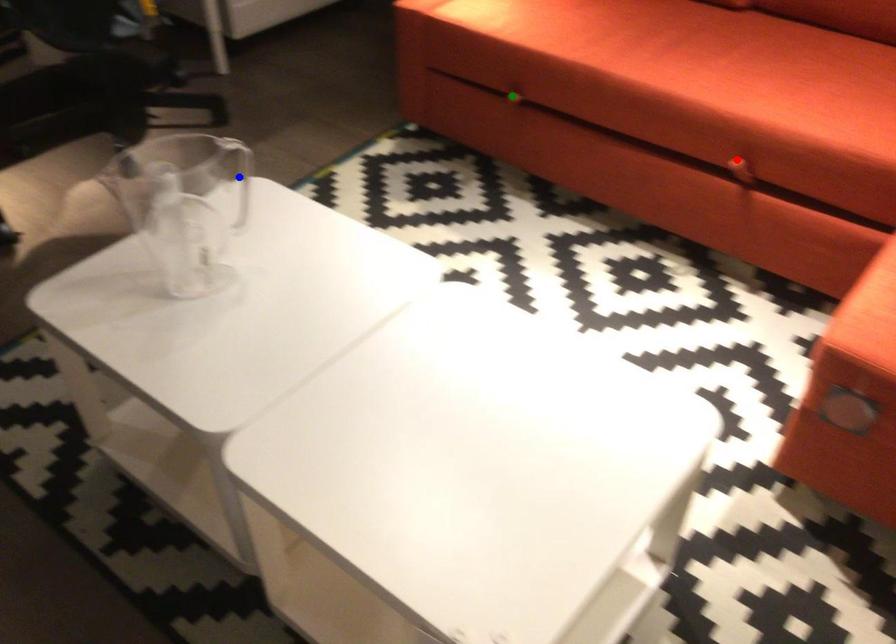
From the picture: Order these from nearest to farthest:
A) blue point
B) red point
C) green point

blue point
green point
red point